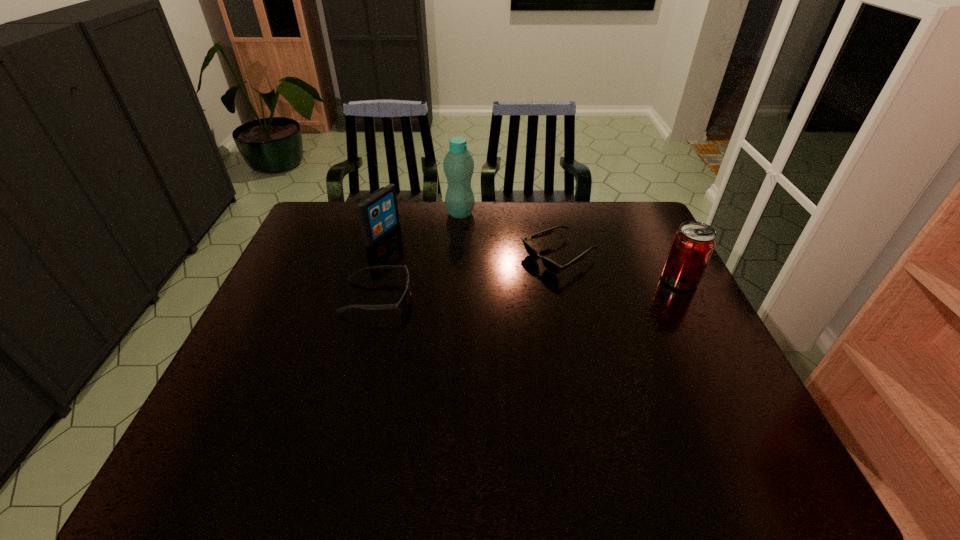
Find the location of a particular element. free space that is in between the rightmost object and the tallest object is located at coordinates (570, 247).

Where is `free space between the iPod and the right sunglasses`? Image resolution: width=960 pixels, height=540 pixels. free space between the iPod and the right sunglasses is located at coordinates [470, 246].

I want to click on empty space that is in between the rightmost object and the left sunglasses, so click(528, 289).

You are a GUI agent. You are given a task and a screenshot of the screen. Output one action in this format:
    pyautogui.click(x=<x>, y=<y>)
    Task: Click on the empty space between the third object from right to left and the fourth object from left to right
    
    Given the screenshot: What is the action you would take?
    pyautogui.click(x=510, y=235)

Find the location of `free space between the rightmost object and the left sunglasses`. free space between the rightmost object and the left sunglasses is located at coordinates 528,289.

I want to click on empty location between the iPod and the right sunglasses, so click(x=470, y=246).

The height and width of the screenshot is (540, 960). Find the location of `free space that is in between the tallest object and the rightmost object`. free space that is in between the tallest object and the rightmost object is located at coordinates [x=570, y=247].

This screenshot has width=960, height=540. I want to click on object that stands as the second closest to the iPod, so click(x=458, y=164).

You are a GUI agent. You are given a task and a screenshot of the screen. Output one action in this format:
    pyautogui.click(x=<x>, y=<y>)
    Task: Click on the object identified as the closest to the tallest object
    This screenshot has width=960, height=540.
    Given the screenshot: What is the action you would take?
    pyautogui.click(x=378, y=214)

This screenshot has height=540, width=960. I want to click on blank space that satisfies the following two spatial constraints: 1. on the front side of the third object from left to right; 2. on the left side of the right sunglasses, so click(x=458, y=257).